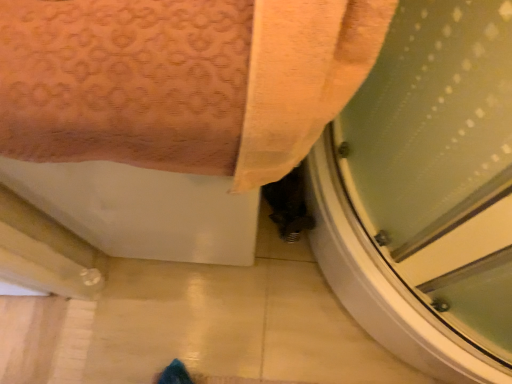
Measure the distance between transparent plastic screen door at lower right and camera.

The distance of transparent plastic screen door at lower right from camera is 25.62 inches.

Describe the element at coordinates (426, 192) in the screenshot. Image resolution: width=512 pixels, height=384 pixels. I see `transparent plastic screen door at lower right` at that location.

You are a GUI agent. You are given a task and a screenshot of the screen. Output one action in this format:
    pyautogui.click(x=<x>, y=<y>)
    Task: Click on the transparent plastic screen door at lower right
    The image size is (512, 384).
    Given the screenshot: What is the action you would take?
    pyautogui.click(x=426, y=192)

In order to face matte pink towel at upper left, should I rotate leftwards or rightwards?

You should rotate left by 10.891 degrees.

Looking at this image, measure the distance between matte pink towel at upper left and camera.

The distance of matte pink towel at upper left from camera is 15.09 inches.

What do you see at coordinates (182, 80) in the screenshot? I see `matte pink towel at upper left` at bounding box center [182, 80].

The width and height of the screenshot is (512, 384). I want to click on matte pink towel at upper left, so click(182, 80).

I want to click on transparent plastic screen door at lower right, so click(x=426, y=192).

Between matte pink towel at upper left and transparent plastic screen door at lower right, which one appears on the right side from the viewer's perspective?

Positioned to the right is transparent plastic screen door at lower right.

In the image, is matte pink towel at upper left positioned in front of or behind transparent plastic screen door at lower right?

Clearly, matte pink towel at upper left is in front of transparent plastic screen door at lower right.

Which is closer, (99, 58) or (420, 320)?

Point (99, 58).

From the image's perspective, which is above, matte pink towel at upper left or transparent plastic screen door at lower right?

matte pink towel at upper left.

From a real-world perspective, relative to transparent plastic screen door at lower right, is matte pink towel at upper left vertically above or below?

matte pink towel at upper left is situated higher than transparent plastic screen door at lower right in the real world.

Looking at their sizes, would you say matte pink towel at upper left is wider or thinner than transparent plastic screen door at lower right?

Clearly, matte pink towel at upper left has more width compared to transparent plastic screen door at lower right.

Does matte pink towel at upper left have a lesser height compared to transparent plastic screen door at lower right?

No.

Between matte pink towel at upper left and transparent plastic screen door at lower right, which one has smaller size?

With smaller size is transparent plastic screen door at lower right.

Do you think matte pink towel at upper left is within transparent plastic screen door at lower right, or outside of it?

matte pink towel at upper left is located beyond the bounds of transparent plastic screen door at lower right.

Are matte pink towel at upper left and transparent plastic screen door at lower right located far from each other?

That's not correct — matte pink towel at upper left is a little close to transparent plastic screen door at lower right.

Is matte pink towel at upper left aimed at transparent plastic screen door at lower right?

No, matte pink towel at upper left is not aimed at transparent plastic screen door at lower right.

I want to click on towel that appears on the left of transparent plastic screen door at lower right, so click(182, 80).

Consider the image. In the image, is transparent plastic screen door at lower right on the left side or the right side of matte pink towel at upper left?

In the image, transparent plastic screen door at lower right appears on the right side of matte pink towel at upper left.

In the image, is transparent plastic screen door at lower right positioned in front of or behind matte pink towel at upper left?

In the image, transparent plastic screen door at lower right appears behind matte pink towel at upper left.

Does point (362, 277) lie behind point (32, 66)?

Yes, it is.

From the image's perspective, which one is positioned higher, transparent plastic screen door at lower right or matte pink towel at upper left?

matte pink towel at upper left, from the image's perspective.

Consider the image. From a real-world perspective, is transparent plastic screen door at lower right on matte pink towel at upper left?

Incorrect, from a real-world perspective, transparent plastic screen door at lower right is lower than matte pink towel at upper left.

Does transparent plastic screen door at lower right have a lesser width compared to matte pink towel at upper left?

Correct, the width of transparent plastic screen door at lower right is less than that of matte pink towel at upper left.

Considering the sizes of objects transparent plastic screen door at lower right and matte pink towel at upper left in the image provided, who is taller, transparent plastic screen door at lower right or matte pink towel at upper left?

matte pink towel at upper left.

In the scene shown: In terms of size, does transparent plastic screen door at lower right appear bigger or smaller than matte pink towel at upper left?

Considering their sizes, transparent plastic screen door at lower right takes up less space than matte pink towel at upper left.

Does transparent plastic screen door at lower right contain matte pink towel at upper left?

No, matte pink towel at upper left is not inside transparent plastic screen door at lower right.

Is transparent plastic screen door at lower right far away from matte pink towel at upper left?

No, there isn't a large distance between transparent plastic screen door at lower right and matte pink towel at upper left.

Could you tell me if transparent plastic screen door at lower right is turned towards matte pink towel at upper left?

Yes.

Identify the location of towel that is in front of the transparent plastic screen door at lower right. (182, 80).

This screenshot has height=384, width=512. I want to click on towel lying above the transparent plastic screen door at lower right (from the image's perspective), so click(x=182, y=80).

Where is `screen door that is below the matte pink towel at upper left (from the image's perspective)`? This screenshot has height=384, width=512. screen door that is below the matte pink towel at upper left (from the image's perspective) is located at coordinates click(x=426, y=192).